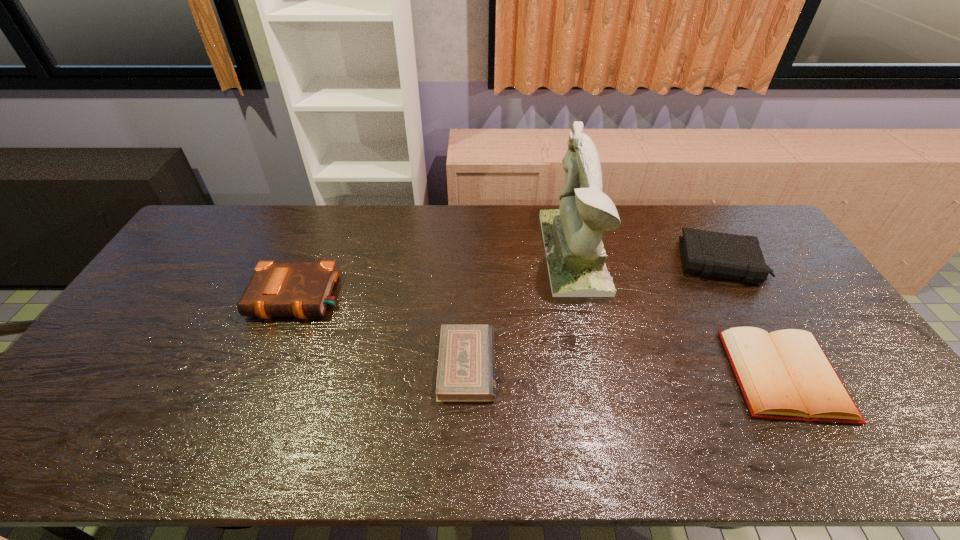
Locate an element on the screen. The height and width of the screenshot is (540, 960). vacant area that lies between the leftmost Bible and the fourth tallest object is located at coordinates (541, 336).

Identify the location of free space between the fourth tallest object and the sculpture. (679, 314).

Where is `object that stands as the fourth closest to the leftmost Bible`? object that stands as the fourth closest to the leftmost Bible is located at coordinates (707, 253).

Locate an element on the screen. Image resolution: width=960 pixels, height=540 pixels. the closest object relative to the fourth tallest object is located at coordinates (707, 253).

At what (x,y) coordinates should I click in order to perform the action: click on Bible that is the fourth closest one to the sculpture. Please return your answer as a coordinate pair (x, y). Looking at the image, I should click on (277, 289).

Identify the location of Bible that can be found as the third closest to the sculpture. This screenshot has width=960, height=540. click(785, 374).

This screenshot has width=960, height=540. I want to click on free space that satisfies the following two spatial constraints: 1. on the back side of the second shortest Bible; 2. on the base of the tallest object, so click(x=713, y=252).

Where is `free spot that satisfies the following two spatial constraints: 1. on the spine side of the fourth object from right to left; 2. on the left side of the third tallest Bible`? free spot that satisfies the following two spatial constraints: 1. on the spine side of the fourth object from right to left; 2. on the left side of the third tallest Bible is located at coordinates (467, 375).

The width and height of the screenshot is (960, 540). Find the location of `free space that satisfies the following two spatial constraints: 1. on the base of the tallest object; 2. on the spine side of the leftmost object`. free space that satisfies the following two spatial constraints: 1. on the base of the tallest object; 2. on the spine side of the leftmost object is located at coordinates point(584,298).